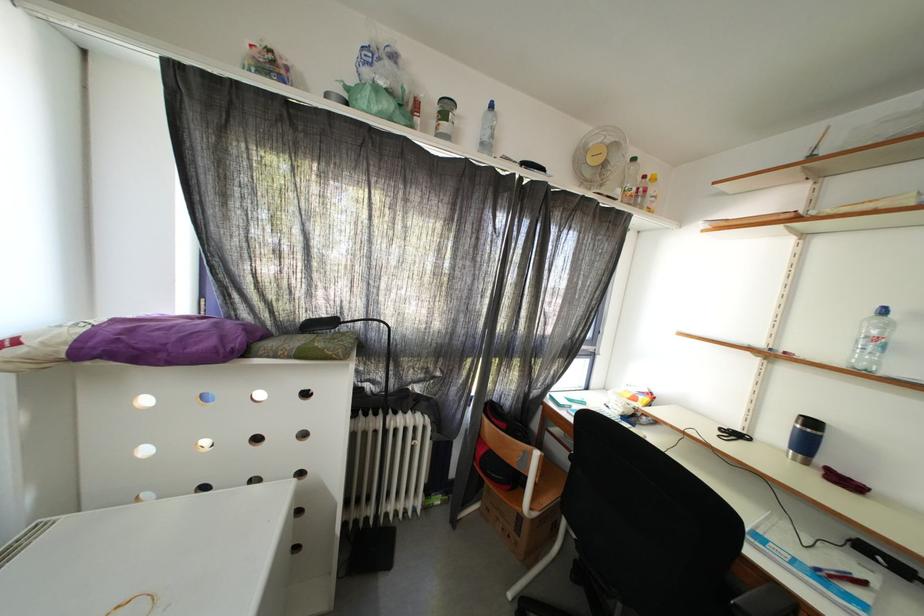
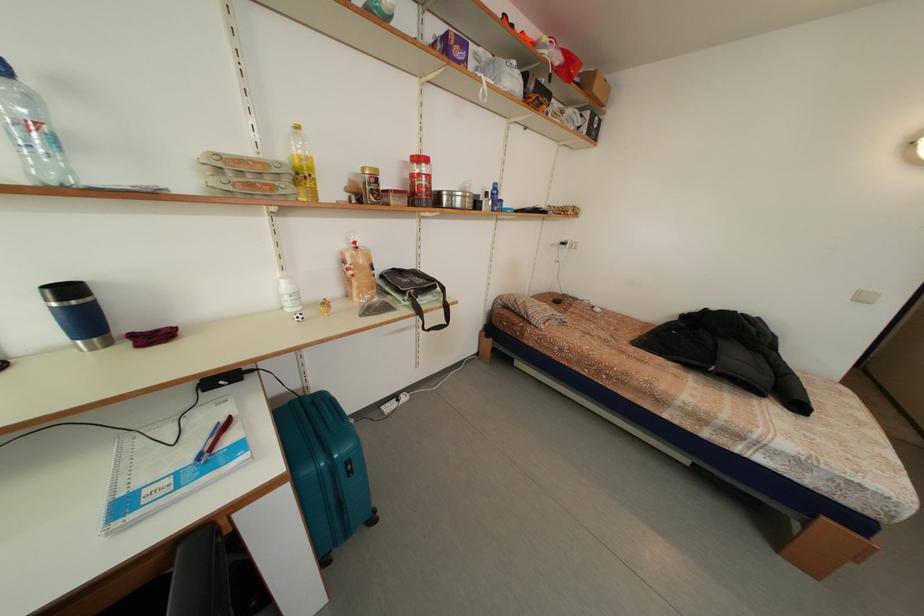
The point at (895, 331) is marked in the first image. Where is the corresponding point in the second image?

(40, 106)